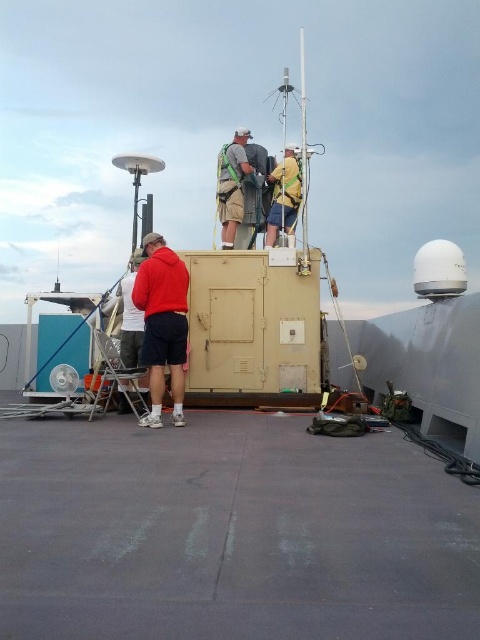
You are standing on the gray rubber deck at center and want to move to the beige rectangular structure. The two individuals are working on top of it. How far apart are you from the beige rectangular structure?

The two individuals are 1.27 meters apart from each other, but the question asks about your distance to the beige rectangular structure. The provided information does not specify your distance to the structure, so I cannot determine that.